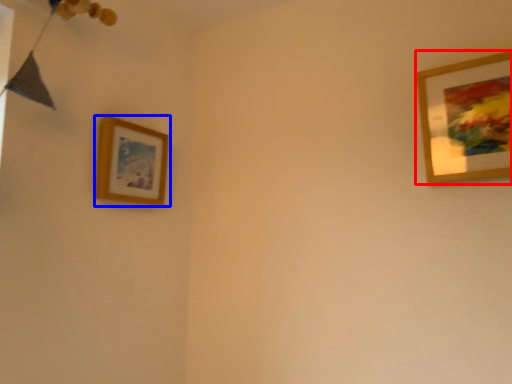
Question: Which object is closer to the camera taking this photo, picture frame (highlighted by a red box) or picture frame (highlighted by a blue box)?

Choices:
 (A) picture frame
 (B) picture frame

Answer: (A)